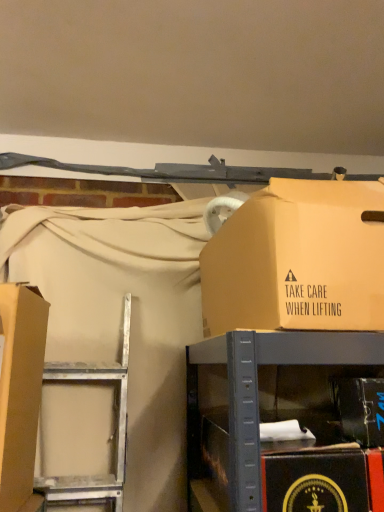
Question: Is matte cardboard box at upper right, the 2th box viewed from the right, taller or shorter than metallic black box at lower right, arranged as the third box when viewed from the left?

Choices:
 (A) short
 (B) tall

Answer: (B)

Question: Is point (309, 263) closer or farther from the camera than point (354, 399)?

Choices:
 (A) farther
 (B) closer

Answer: (B)

Question: Estimate the real-world distances between objects in this image. Which object is closer to the metallic cardboard box at center?

Choices:
 (A) metallic black box at lower right, the 1th box positioned from the right
 (B) matte cardboard box at left, acting as the first box starting from the left
 (C) matte cardboard box at upper right, the 2th box viewed from the right

Answer: (C)

Question: Based on their relative distances, which object is farther from the metallic cardboard box at center?

Choices:
 (A) matte cardboard box at left, acting as the first box starting from the left
 (B) matte cardboard box at upper right, arranged as the second box when viewed from the left
 (C) metallic black box at lower right, the 1th box positioned from the right

Answer: (A)